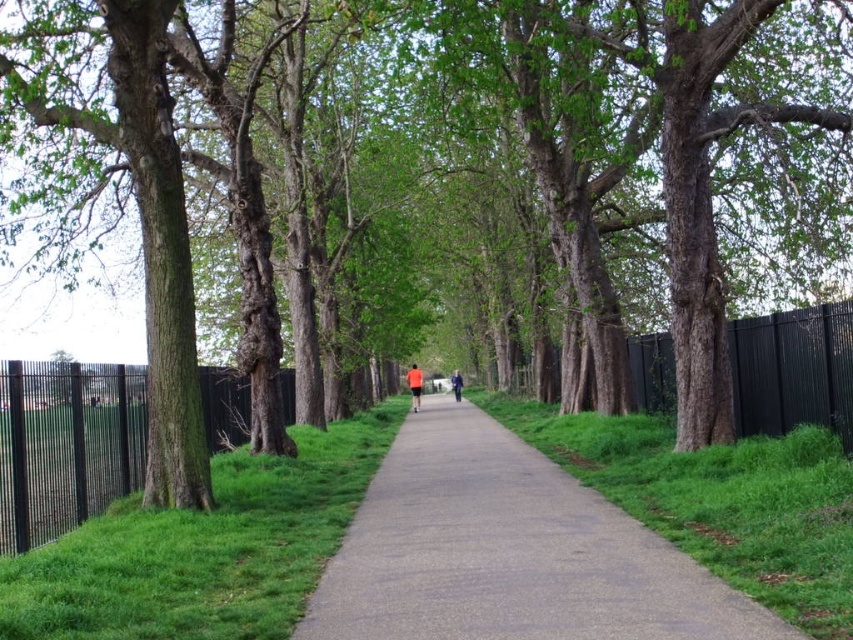
You are standing on the pathway and see the green grass at lower left and the orange fabric at center. Which object is nearer to you?

The green grass at lower left is closer to the viewer than the orange fabric at center.

You are standing at the starting point of the pathway and want to reach the green grass at lower left located at point (204, 548). What direction should you move in relative to the pathway?

You should move to the left relative to the pathway to reach the green grass at lower left located at point (204, 548).